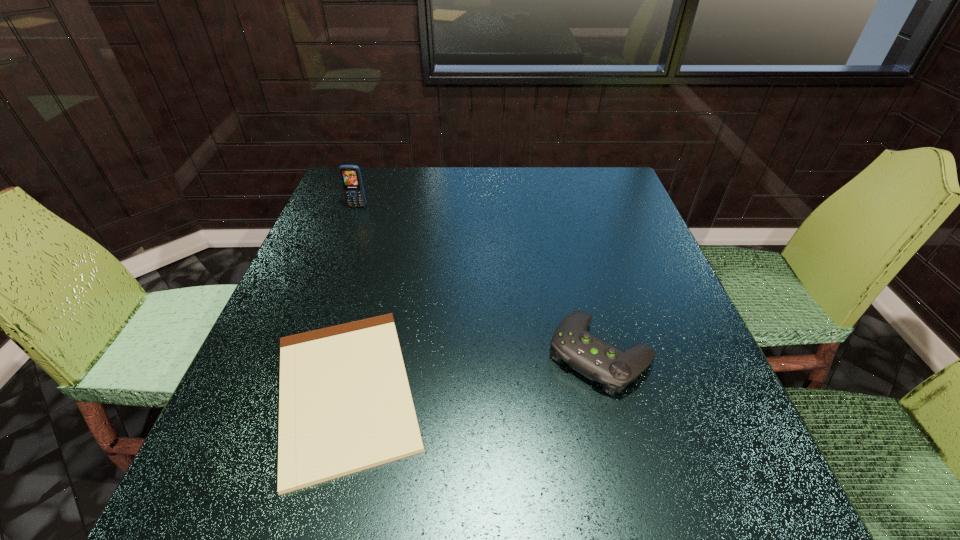
At what (x,y) coordinates should I click in order to perform the action: click on cellular telephone. Please return your answer as a coordinate pair (x, y). This screenshot has width=960, height=540. Looking at the image, I should click on (350, 175).

Locate an element on the screen. This screenshot has height=540, width=960. the tallest object is located at coordinates (350, 175).

The image size is (960, 540). In order to click on control in this screenshot , I will do `click(586, 353)`.

Find the location of a particular element. The width and height of the screenshot is (960, 540). the second shortest object is located at coordinates (586, 353).

Where is `the shortest object`? The image size is (960, 540). the shortest object is located at coordinates (345, 405).

Find the location of a particular element. This screenshot has width=960, height=540. free space located 0.150m on the screen of the tallest object is located at coordinates (344, 241).

I want to click on vacant area located 0.290m on the back of the second tallest object, so 569,234.

Where is `vacant space situated 0.310m on the right of the clipboard`? Image resolution: width=960 pixels, height=540 pixels. vacant space situated 0.310m on the right of the clipboard is located at coordinates (603, 390).

You are a GUI agent. You are given a task and a screenshot of the screen. Output one action in this format:
    pyautogui.click(x=<x>, y=<y>)
    Task: Click on the object that is at the far edge
    The image size is (960, 540).
    Given the screenshot: What is the action you would take?
    pyautogui.click(x=350, y=175)

At what (x,y) coordinates should I click in order to perform the action: click on object situated at the near edge. Please return your answer as a coordinate pair (x, y). This screenshot has height=540, width=960. Looking at the image, I should click on (345, 405).